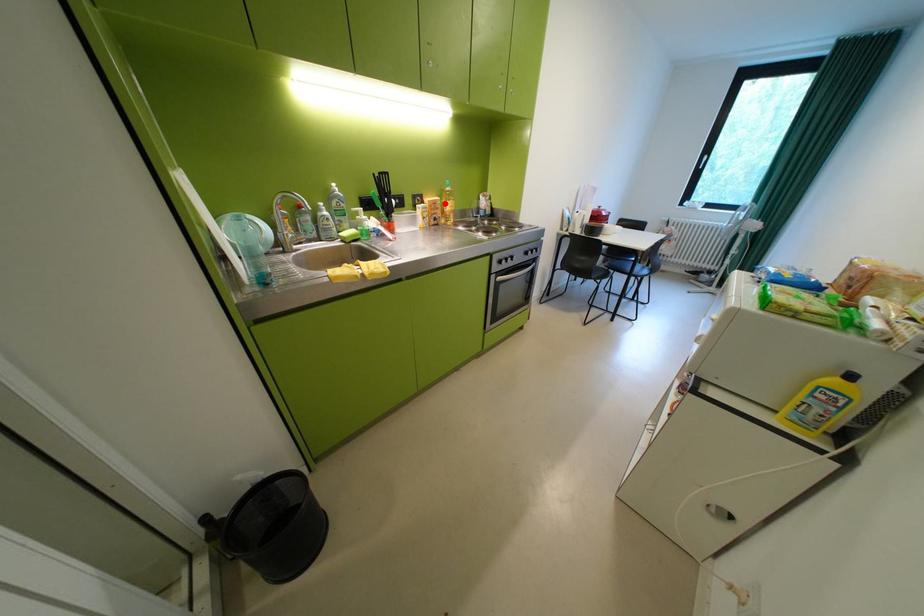
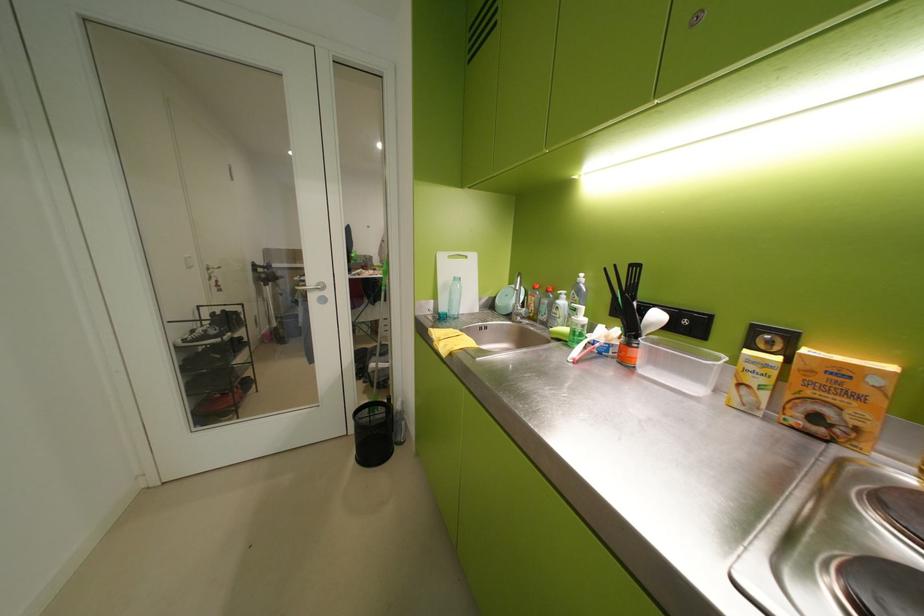
Find the pixel in the second image that matches the highlighted location in the first image.

(852, 373)